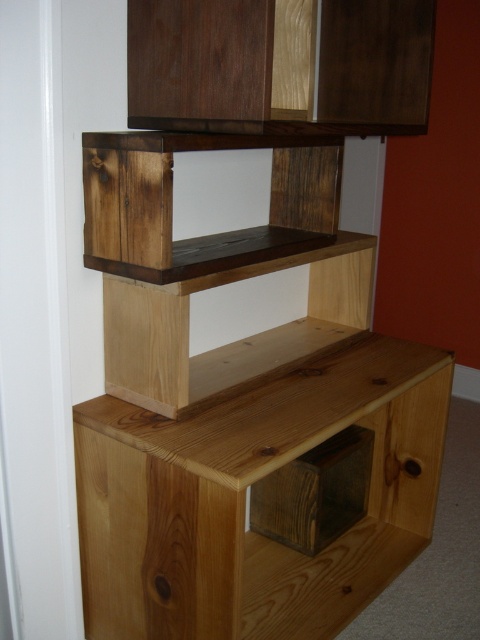
Question: Which object is closer to the camera taking this photo?

Choices:
 (A) natural wood drawer at lower center
 (B) dark brown wood cabinet at upper center

Answer: (B)

Question: Which object is positioned farthest from the rustic wood shelf at center?

Choices:
 (A) natural wood drawer at lower center
 (B) dark brown wood cabinet at upper center

Answer: (A)

Question: Can you confirm if dark brown wood cabinet at upper center is positioned above natural wood shelf at center?

Choices:
 (A) yes
 (B) no

Answer: (A)

Question: Can you confirm if dark brown wood cabinet at upper center is positioned to the right of rustic wood shelf at center?

Choices:
 (A) yes
 (B) no

Answer: (A)

Question: Can you confirm if dark brown wood cabinet at upper center is smaller than rustic wood shelf at center?

Choices:
 (A) yes
 (B) no

Answer: (B)

Question: Which point is closer to the camera taking this photo?

Choices:
 (A) (292, 252)
 (B) (379, 68)
 (C) (345, 243)

Answer: (A)